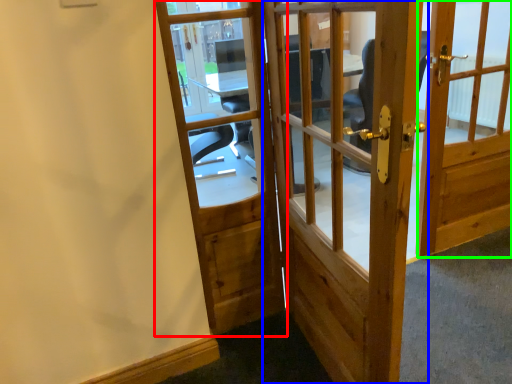
Question: Based on their relative distances, which object is nearer to door (highlighted by a red box)? Choose from door (highlighted by a blue box) and door (highlighted by a green box).

Choices:
 (A) door
 (B) door

Answer: (A)